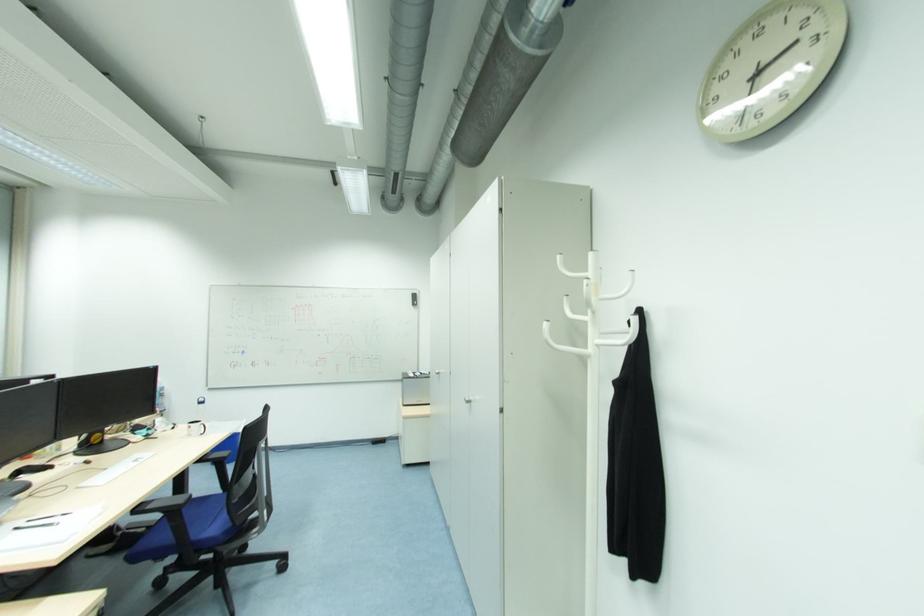
Where is `black chair armrest`? The width and height of the screenshot is (924, 616). black chair armrest is located at coordinates (161, 505).